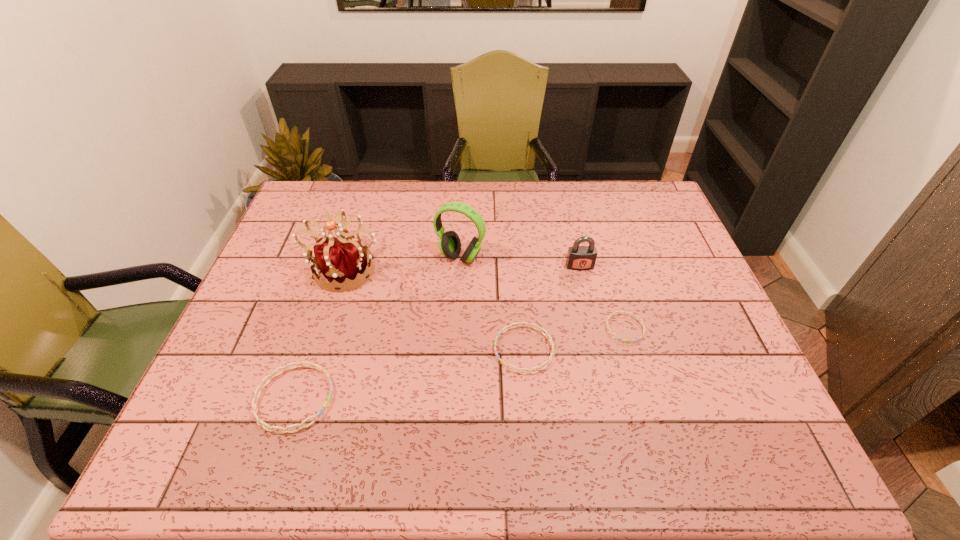
The image size is (960, 540). Find the location of `vacant area that lies between the headset and the leftmost bracelet`. vacant area that lies between the headset and the leftmost bracelet is located at coordinates (377, 328).

The height and width of the screenshot is (540, 960). In order to click on empty space between the tiara and the third object from left to right in this screenshot , I will do `click(402, 263)`.

Locate an element on the screen. free area in between the leftmost bracelet and the second shortest bracelet is located at coordinates (409, 374).

You are a GUI agent. You are given a task and a screenshot of the screen. Output one action in this format:
    pyautogui.click(x=<x>, y=<y>)
    Task: Click on the free space between the second bracelet from right to left and the tiara
    This screenshot has width=960, height=540.
    Given the screenshot: What is the action you would take?
    pyautogui.click(x=434, y=309)

At what (x,y) coordinates should I click in order to perform the action: click on free point between the shortest bracelet and the third object from left to right. Please return your answer as a coordinate pair (x, y). Looking at the image, I should click on (542, 293).

Where is `free spot between the tiara and the second shortest bracelet`? This screenshot has height=540, width=960. free spot between the tiara and the second shortest bracelet is located at coordinates (434, 309).

Where is `object that is the second closest one to the leftmost bracelet`? object that is the second closest one to the leftmost bracelet is located at coordinates (547, 335).

Locate which object ranks fourth in proximity to the tiara. Please provide its 2D coordinates. Your answer should be formatted as a tuple, i.e. [(x, y)], where the tuple contains the x and y coordinates of a point satisfying the conditions above.

[(580, 258)]

Locate which bracelet ranks in proximity to the shortest object. Please provide its 2D coordinates. Your answer should be formatted as a tuple, i.e. [(x, y)], where the tuple contains the x and y coordinates of a point satisfying the conditions above.

[(547, 335)]

Choose which bracelet is the second nearest neighbor to the tiara. Please provide its 2D coordinates. Your answer should be formatted as a tuple, i.e. [(x, y)], where the tuple contains the x and y coordinates of a point satisfying the conditions above.

[(547, 335)]